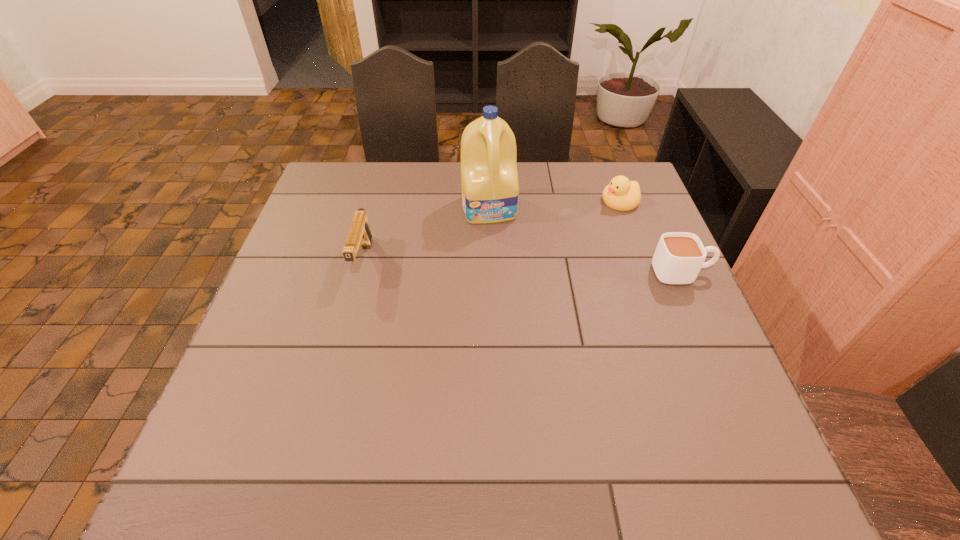
Identify the location of the second tallest object. (359, 233).

The image size is (960, 540). What are the coordinates of `the leftmost object` in the screenshot? It's located at (359, 233).

Locate an element on the screen. This screenshot has width=960, height=540. cup is located at coordinates (679, 256).

The height and width of the screenshot is (540, 960). Find the location of `duckling`. duckling is located at coordinates (621, 194).

Identify the location of detergent. (489, 178).

Locate an element on the screen. the tallest object is located at coordinates (489, 178).

The width and height of the screenshot is (960, 540). What are the coordinates of `free location located at the barrel of the second tallest object` in the screenshot? It's located at (330, 386).

Locate an element on the screen. The image size is (960, 540). free space located 0.080m on the face of the duckling is located at coordinates (587, 217).

This screenshot has width=960, height=540. Identify the location of free spot located 0.290m on the face of the duckling. (528, 244).

Locate an element on the screen. free point located 0.180m on the face of the duckling is located at coordinates coord(560,229).